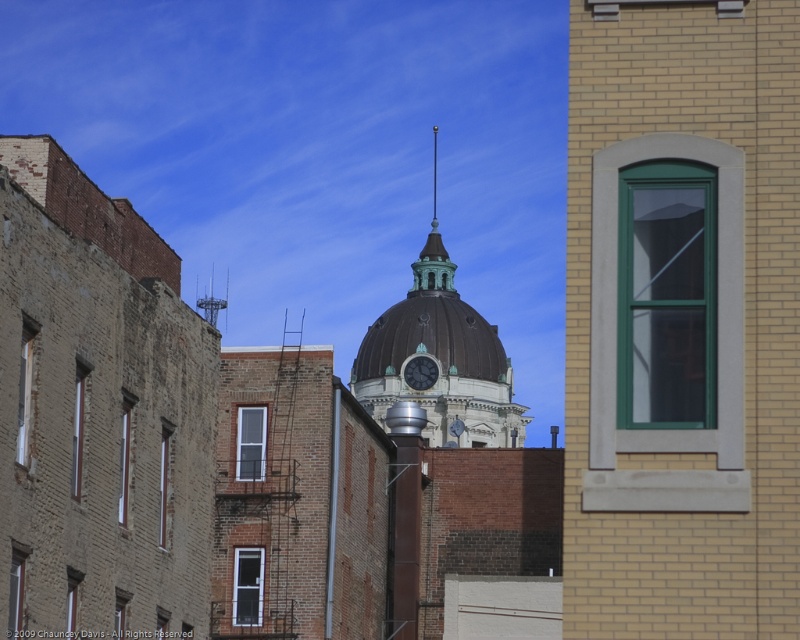
You are standing in front of the historic building with the dome. You notice a point marked at coordinates (420,372). What object is located at this point?

The point at coordinates (420,372) corresponds to the matte black clock at center.

You are an architect examining the historic building. You notice the matte black clock at center and the metallic spire at upper center. Which object takes up more visual space in the image?

The metallic spire at upper center occupies more visual space than the matte black clock at center.